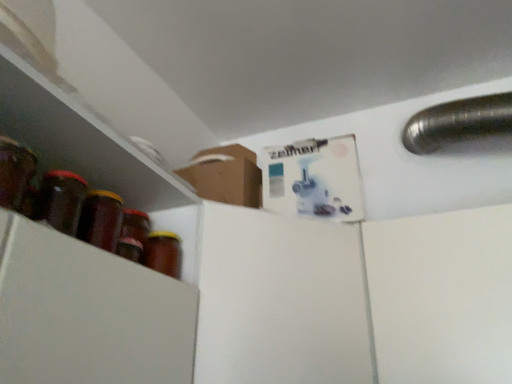
The image size is (512, 384). Describe the element at coordinates (163, 253) in the screenshot. I see `brown glass jar at left` at that location.

Identify the location of brown glass jar at left. The image size is (512, 384). (163, 253).

Identify the location of brown glass jar at left. Image resolution: width=512 pixels, height=384 pixels. (163, 253).